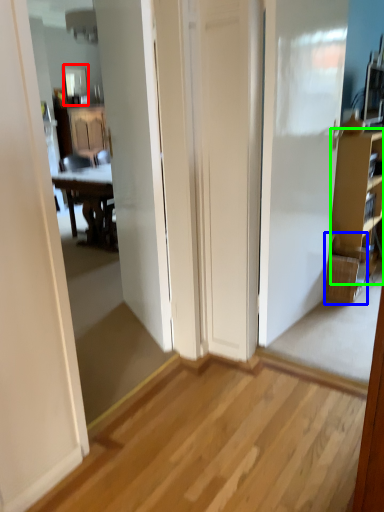
Question: Which object is positioned closest to mirror (highlighted by a red box)? Select from picnic basket (highlighted by a blue box) and cabinetry (highlighted by a green box).

Choices:
 (A) picnic basket
 (B) cabinetry

Answer: (B)